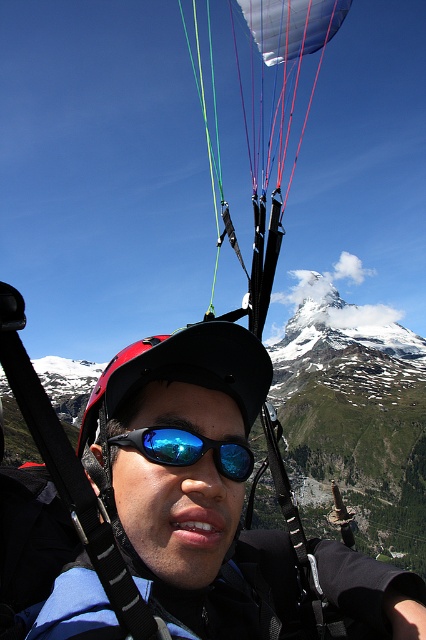
Does matte black helmet at center lie in front of blue reflective lens goggles at center?

Yes, it is.

Does matte black helmet at center appear over blue reflective lens goggles at center?

Actually, matte black helmet at center is below blue reflective lens goggles at center.

Does point (206, 627) lie in front of point (238, 458)?

Yes, it is in front of point (238, 458).

Locate an element on the screen. matte black helmet at center is located at coordinates (181, 467).

Does matte black helmet at center appear over matte black parachute at center?

Actually, matte black helmet at center is below matte black parachute at center.

Who is higher up, matte black helmet at center or matte black parachute at center?

matte black parachute at center is higher up.

Between point (190, 392) and point (316, 16), which one is positioned in front?

Point (190, 392) is in front.

I want to click on matte black helmet at center, so 181,467.

Between matte black parachute at center and blue reflective lens goggles at center, which one appears on the left side from the viewer's perspective?

blue reflective lens goggles at center is more to the left.

Does matte black parachute at center have a lesser height compared to blue reflective lens goggles at center?

No.

Between point (218, 125) and point (132, 429), which one is positioned in front?

Point (132, 429) is in front.

Locate an element on the screen. The image size is (426, 640). matte black parachute at center is located at coordinates (264, 116).